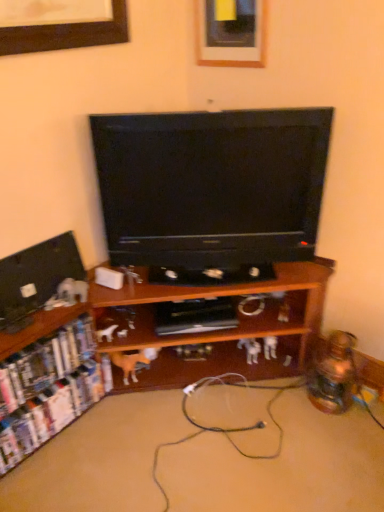
Question: Is black rubber extension cord at lower center wider than white cardboard shelf at lower left, positioned as the second shelf in right-to-left order?

Choices:
 (A) yes
 (B) no

Answer: (B)

Question: Is black rubber extension cord at lower center to the right of white cardboard shelf at lower left, positioned as the second shelf in right-to-left order, from the viewer's perspective?

Choices:
 (A) yes
 (B) no

Answer: (A)

Question: Is black rubber extension cord at lower center smaller than white cardboard shelf at lower left, positioned as the second shelf in right-to-left order?

Choices:
 (A) no
 (B) yes

Answer: (B)

Question: Is black rubber extension cord at lower center next to white cardboard shelf at lower left, the first shelf positioned from the left, and touching it?

Choices:
 (A) yes
 (B) no

Answer: (B)

Question: From a real-world perspective, is black rubber extension cord at lower center physically above white cardboard shelf at lower left, positioned as the second shelf in right-to-left order?

Choices:
 (A) yes
 (B) no

Answer: (B)

Question: From a real-world perspective, is black rubber extension cord at lower center physically located above or below wooden shelf at lower left?

Choices:
 (A) above
 (B) below

Answer: (A)

Question: In the image, is black rubber extension cord at lower center positioned in front of or behind wooden shelf at lower left?

Choices:
 (A) behind
 (B) front

Answer: (A)

Question: From the image's perspective, is black rubber extension cord at lower center above or below wooden shelf at lower left?

Choices:
 (A) above
 (B) below

Answer: (A)

Question: Is black rubber extension cord at lower center wider or thinner than wooden shelf at lower left?

Choices:
 (A) wide
 (B) thin

Answer: (B)

Question: Is matte wooden picture frame at upper center taller or shorter than black glossy television at center?

Choices:
 (A) short
 (B) tall

Answer: (A)

Question: From the image's perspective, is matte wooden picture frame at upper center positioned above or below black glossy television at center?

Choices:
 (A) below
 (B) above

Answer: (B)

Question: In the image, is matte wooden picture frame at upper center positioned in front of or behind black glossy television at center?

Choices:
 (A) behind
 (B) front

Answer: (A)

Question: Which is correct: matte wooden picture frame at upper center is inside black glossy television at center, or outside of it?

Choices:
 (A) outside
 (B) inside

Answer: (A)

Question: From a real-world perspective, relative to white cardboard shelf at lower left, the first shelf positioned from the left, is wooden shelf at center, arranged as the 1th shelf when viewed from the right, vertically above or below?

Choices:
 (A) below
 (B) above

Answer: (B)

Question: Is wooden shelf at center, arranged as the 1th shelf when viewed from the right, situated inside white cardboard shelf at lower left, positioned as the second shelf in right-to-left order, or outside?

Choices:
 (A) inside
 (B) outside

Answer: (B)